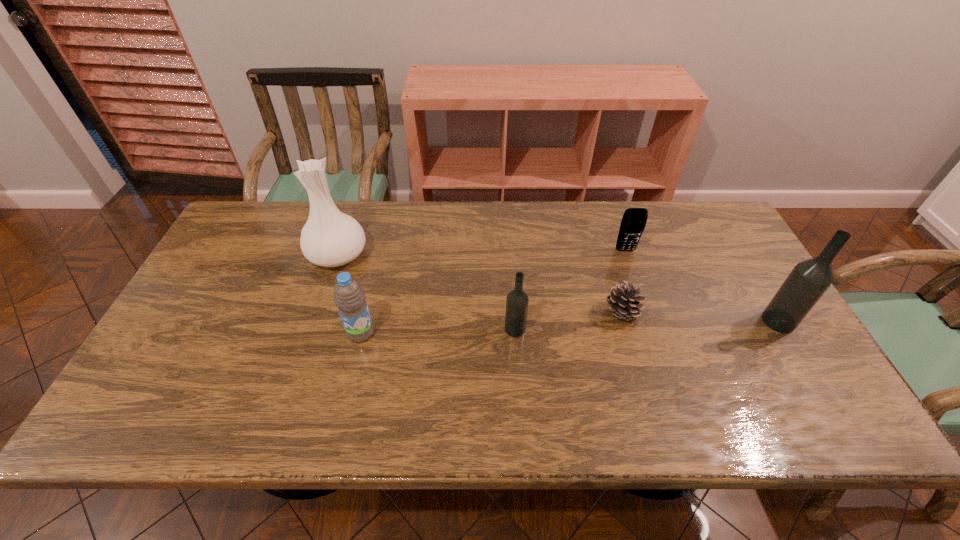
Identify the location of vacant region that satisfies the following two spatial constraints: 1. on the screen of the right vodka; 2. on the left side of the cellular telephone. (649, 321).

Locate an element on the screen. The width and height of the screenshot is (960, 540). vacant space that satisfies the following two spatial constraints: 1. on the front side of the vase; 2. on the left side of the water bottle is located at coordinates (313, 333).

At what (x,y) coordinates should I click in order to perform the action: click on free space in the image that satisfies the following two spatial constraints: 1. on the screen of the cellular telephone; 2. on the right side of the taller vodka. Please return your answer as a coordinate pair (x, y). The width and height of the screenshot is (960, 540). Looking at the image, I should click on pyautogui.click(x=649, y=321).